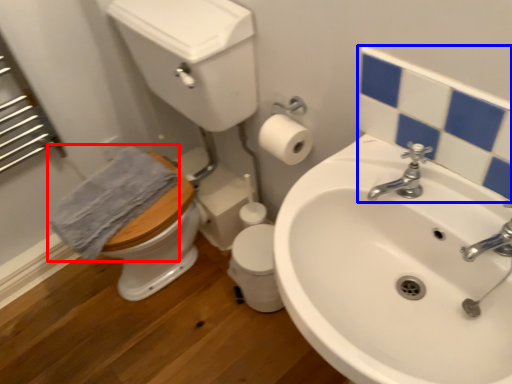
Question: Which point is closer to the camera, bath towel (highlighted by a red box) or mirror (highlighted by a blue box)?

Choices:
 (A) bath towel
 (B) mirror

Answer: (B)